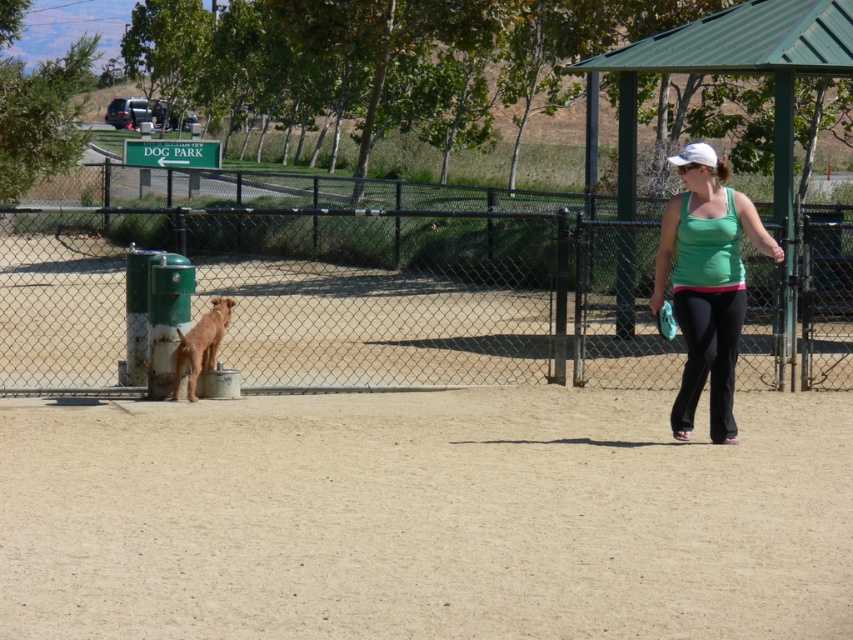
You are a photographer standing at the entrance of the dog park. You want to take a photo of the brown sandy dirt at center and the brown fur dog at center. Which object is closer to you?

The brown sandy dirt at center is closer to the viewer than the brown fur dog at center.

You are standing at the point with coordinates point (x=215, y=332) and want to walk towards the point (x=291, y=516). Will you be moving towards the direction where the woman is walking?

Yes, because point (x=291, y=516) is in front of point (x=215, y=332), meaning moving towards it aligns with the direction the woman is facing as she walks to the right side of the frame.

You are standing at the point labeled point (482, 234) and want to walk to the point labeled point (523, 481). Which direction should you go?

You should walk forward because point (523, 481) is in front of point (482, 234).